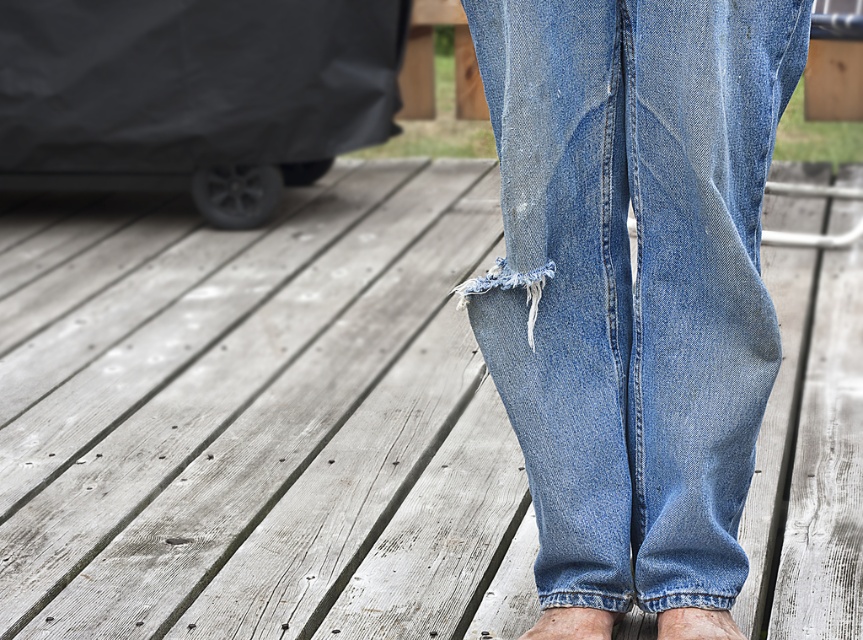
Does denim at center have a larger size compared to blue denim foot at lower center?

Correct, denim at center is larger in size than blue denim foot at lower center.

Is denim at center to the right of blue denim foot at lower center from the viewer's perspective?

Correct, you'll find denim at center to the right of blue denim foot at lower center.

Who is more forward, (616, 452) or (562, 632)?

Positioned in front is point (562, 632).

Find the location of `denim at center`. denim at center is located at coordinates (635, 280).

Is blue denim foot at lower center shorter than light brown skin at lower center?

No, blue denim foot at lower center is not shorter than light brown skin at lower center.

Is blue denim foot at lower center below light brown skin at lower center?

Yes.

Locate an element on the screen. This screenshot has width=863, height=640. blue denim foot at lower center is located at coordinates (572, 624).

Which of these two, denim at center or light brown skin at lower center, stands shorter?

Standing shorter between the two is light brown skin at lower center.

Is point (559, 145) less distant than point (703, 630)?

Yes.

What are the coordinates of `denim at center` in the screenshot? It's located at (x=635, y=280).